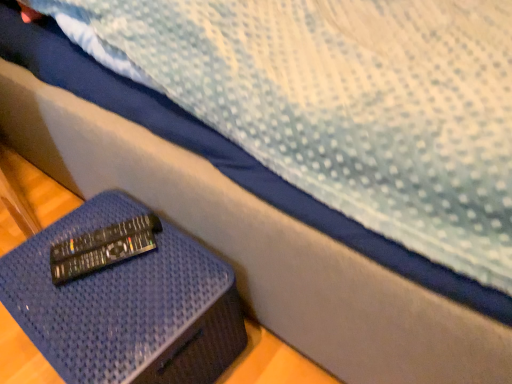
Find the location of a particular element. empty space that is ontop of blue textured ottoman at lower left is located at coordinates (108, 273).